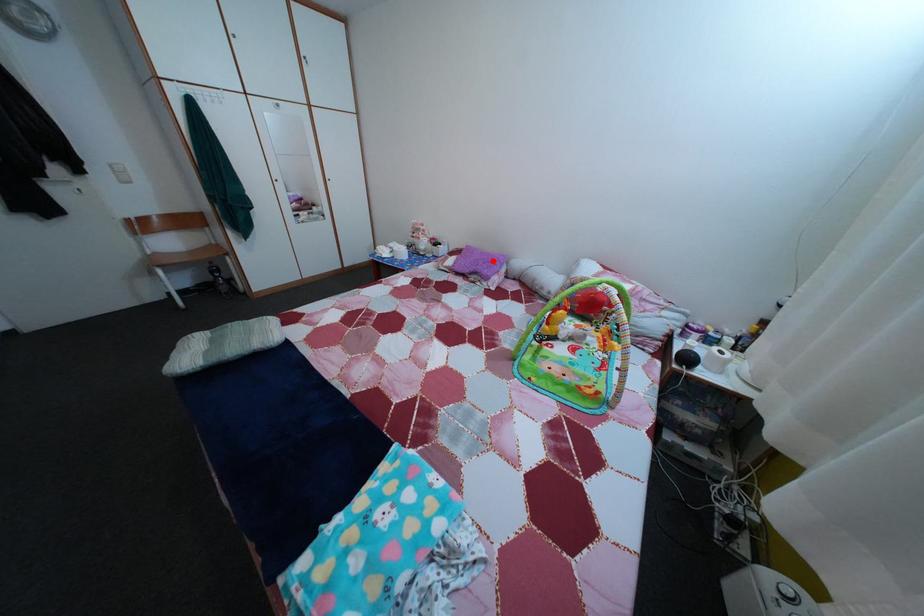
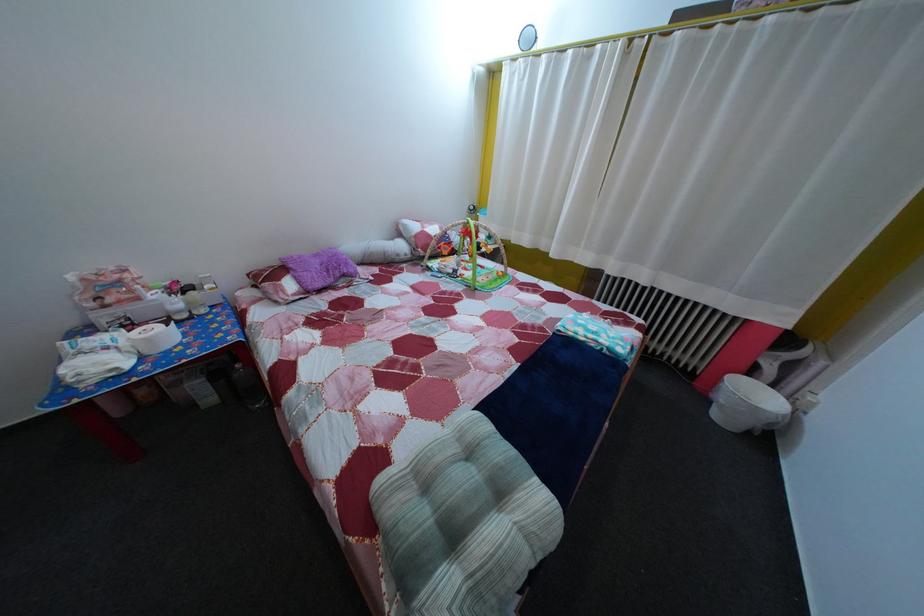
Locate, in the second image, the point that corresponds to the highlighted location in the first image.

(325, 262)